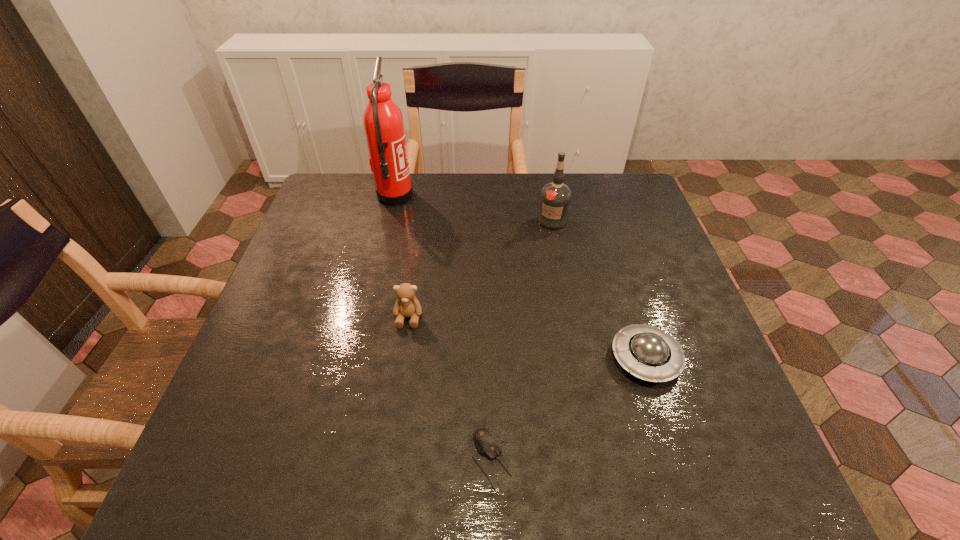
I want to click on free region that satisfies the following two spatial constraints: 1. on the front-facing side of the third object from right to left; 2. on the left side of the third shortest object, so click(388, 460).

You are a GUI agent. You are given a task and a screenshot of the screen. Output one action in this format:
    pyautogui.click(x=<x>, y=<y>)
    Task: Click on the vacant space that satisfies the following two spatial constraints: 1. on the front label of the fourth farthest object; 2. on the left side of the second tallest object
    The image size is (960, 540).
    Given the screenshot: What is the action you would take?
    pyautogui.click(x=578, y=359)

Where is `free space that satisfies the following two spatial constraints: 1. on the label side of the fire extinguisher; 2. on the right side of the rightmost object`? The image size is (960, 540). free space that satisfies the following two spatial constraints: 1. on the label side of the fire extinguisher; 2. on the right side of the rightmost object is located at coordinates (356, 359).